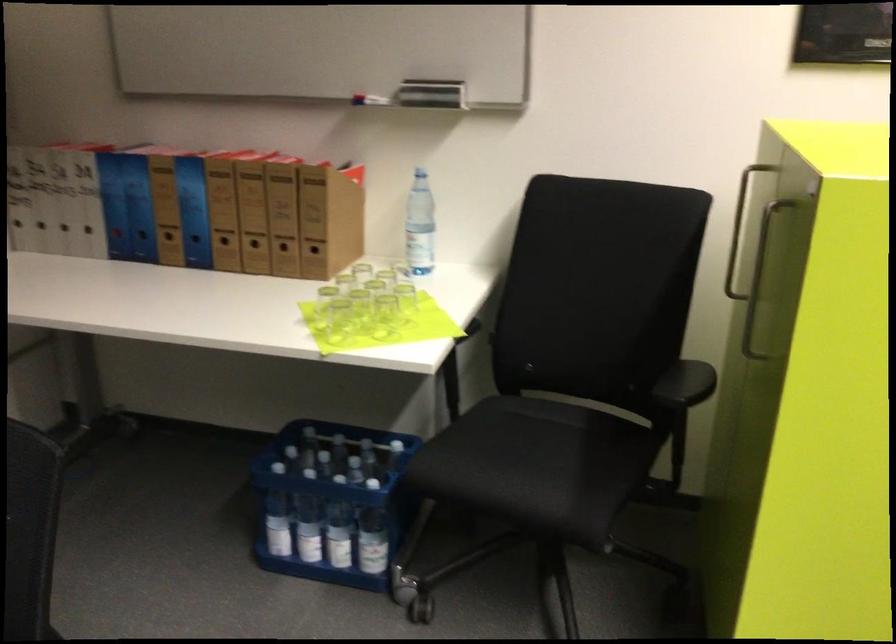
Describe the element at coordinates (685, 384) in the screenshot. I see `a black chair armrest` at that location.